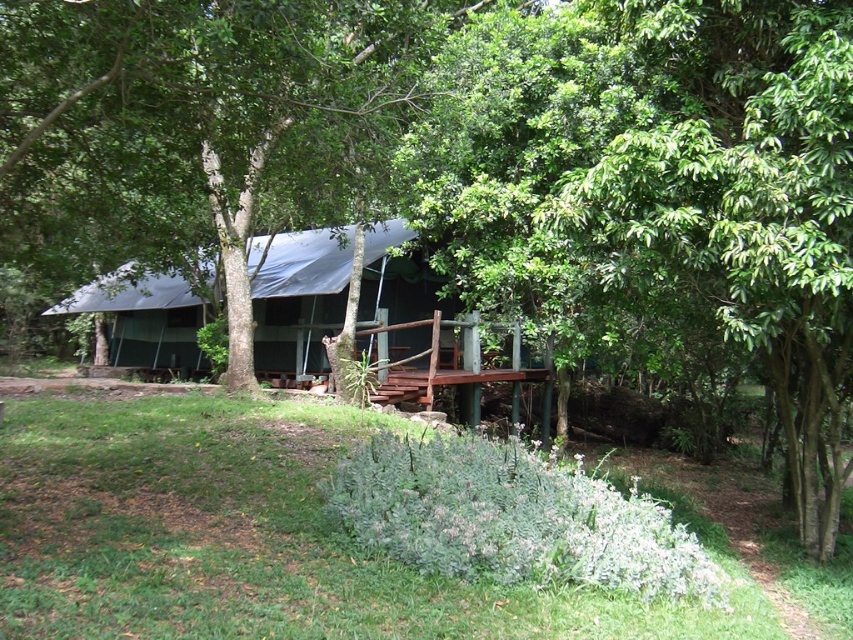
Based on the photo, is white tarpaulin hut at center to the left of white tarpaulin canopy at center from the viewer's perspective?

No, white tarpaulin hut at center is not to the left of white tarpaulin canopy at center.

Consider the image. Between white tarpaulin hut at center and white tarpaulin canopy at center, which one is positioned higher?

white tarpaulin canopy at center

This screenshot has width=853, height=640. Find the location of `white tarpaulin hut at center`. white tarpaulin hut at center is located at coordinates (370, 320).